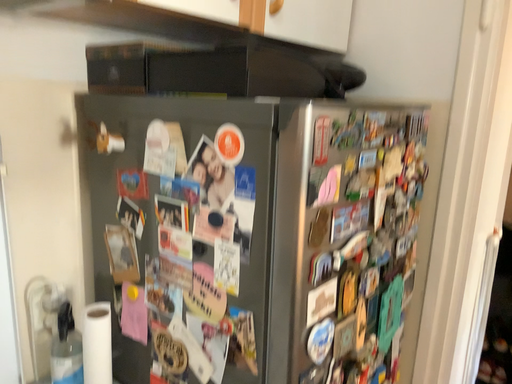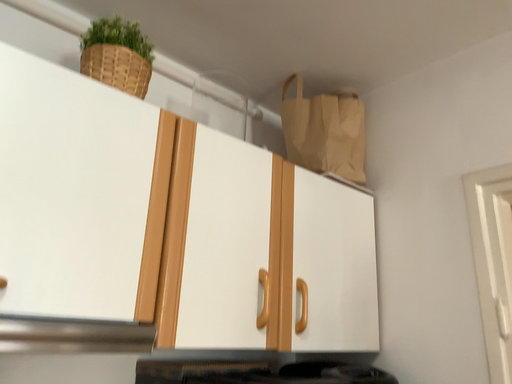
Question: Which way did the camera rotate in the video?

Choices:
 (A) rotated left
 (B) rotated right

Answer: (A)